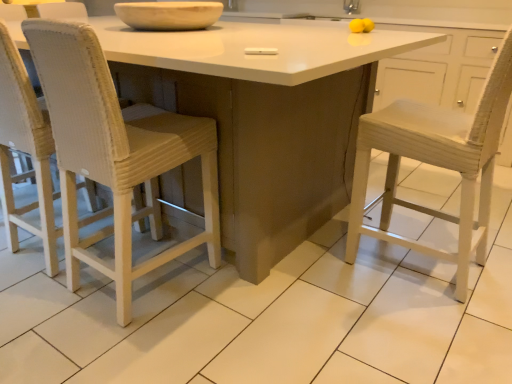
Question: Is woven white chair at left aimed at matte white bowl at upper center?

Choices:
 (A) yes
 (B) no

Answer: (B)

Question: Considering the relative sizes of woven white chair at left and matte white bowl at upper center in the image provided, is woven white chair at left shorter than matte white bowl at upper center?

Choices:
 (A) no
 (B) yes

Answer: (A)

Question: Can you confirm if woven white chair at left is bigger than matte white bowl at upper center?

Choices:
 (A) yes
 (B) no

Answer: (A)

Question: Does woven white chair at left have a greater height compared to matte white bowl at upper center?

Choices:
 (A) yes
 (B) no

Answer: (A)

Question: Can you confirm if woven white chair at left is thinner than matte white bowl at upper center?

Choices:
 (A) no
 (B) yes

Answer: (B)

Question: Are woven white chair at left and matte white bowl at upper center far apart?

Choices:
 (A) no
 (B) yes

Answer: (A)

Question: Does woven white chair at left have a lesser height compared to silver metallic faucet at upper right?

Choices:
 (A) yes
 (B) no

Answer: (B)

Question: Does woven white chair at left have a larger size compared to silver metallic faucet at upper right?

Choices:
 (A) yes
 (B) no

Answer: (A)

Question: Is woven white chair at left with silver metallic faucet at upper right?

Choices:
 (A) no
 (B) yes

Answer: (A)

Question: Is woven white chair at left smaller than silver metallic faucet at upper right?

Choices:
 (A) no
 (B) yes

Answer: (A)

Question: Is woven white chair at left outside silver metallic faucet at upper right?

Choices:
 (A) no
 (B) yes

Answer: (B)

Question: Does woven white chair at left turn towards silver metallic faucet at upper right?

Choices:
 (A) yes
 (B) no

Answer: (A)

Question: Is white matte table at center beside silver metallic faucet at upper right?

Choices:
 (A) no
 (B) yes

Answer: (A)